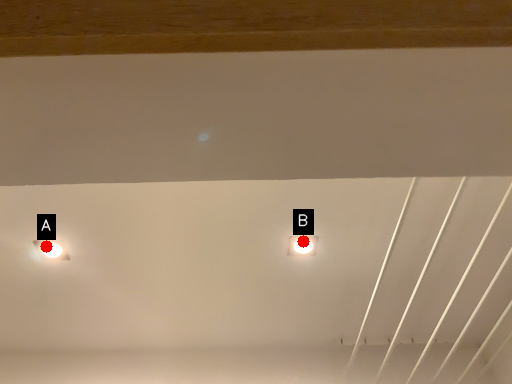
Question: Two points are circled on the image, labeled by A and B beside each circle. Which point is farther from the camera taking this photo?

Choices:
 (A) A is further
 (B) B is further

Answer: (A)